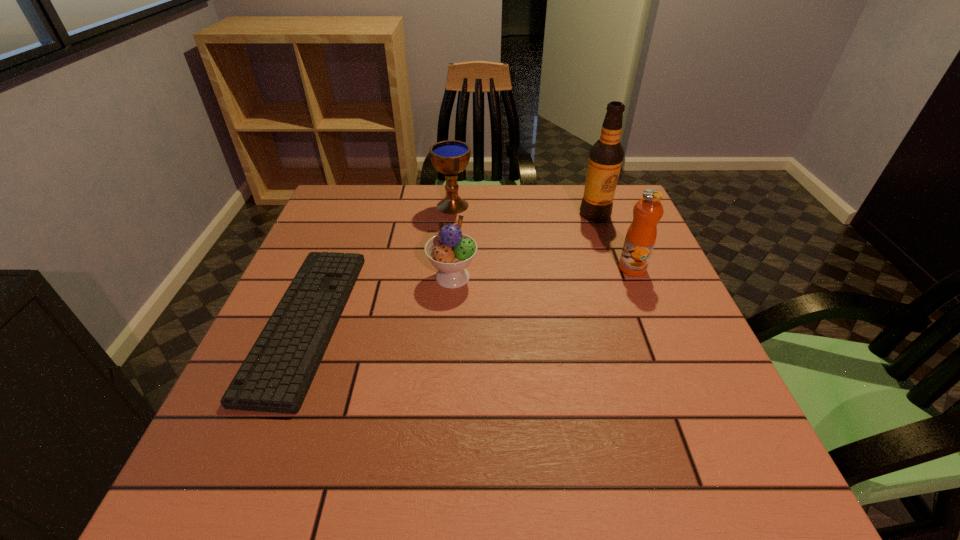
I want to click on blank space located 0.390m on the right of the computer keyboard, so click(526, 322).

Locate an element on the screen. Image resolution: width=960 pixels, height=540 pixels. alcohol that is at the far edge is located at coordinates (605, 159).

Find the location of a particular element. chalice positioned at the far edge is located at coordinates (450, 157).

You are a GUI agent. You are given a task and a screenshot of the screen. Output one action in this format:
    pyautogui.click(x=<x>, y=<y>)
    Task: Click on the object that is at the left edge
    This screenshot has width=960, height=540.
    Given the screenshot: What is the action you would take?
    pyautogui.click(x=277, y=373)

The width and height of the screenshot is (960, 540). Identify the location of alcohol that is at the right edge. (605, 159).

Image resolution: width=960 pixels, height=540 pixels. I want to click on fruit juice located at the right edge, so click(641, 235).

This screenshot has height=540, width=960. Find the location of `object located at the far right corner`. object located at the far right corner is located at coordinates (605, 159).

The image size is (960, 540). What are the coordinates of `free spot at the far edge of the desktop` in the screenshot? It's located at (432, 194).

Locate an element on the screen. Image resolution: width=960 pixels, height=540 pixels. free space at the near edge is located at coordinates (433, 451).

You are a GUI agent. You are given a task and a screenshot of the screen. Output one action in this format:
    pyautogui.click(x=<x>, y=<y>)
    Task: Click on the vacant point at the right edge
    Image resolution: width=960 pixels, height=540 pixels.
    Given the screenshot: What is the action you would take?
    pyautogui.click(x=656, y=366)